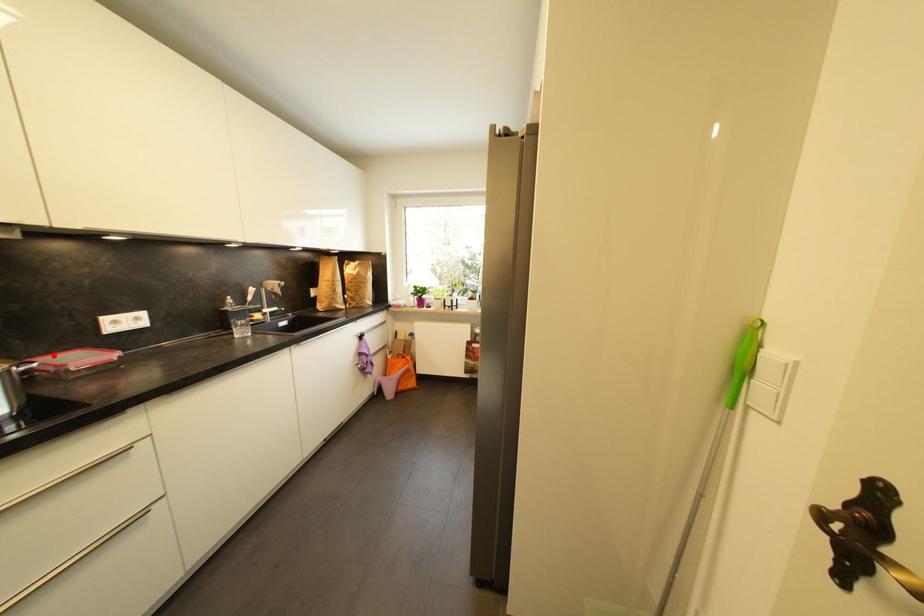
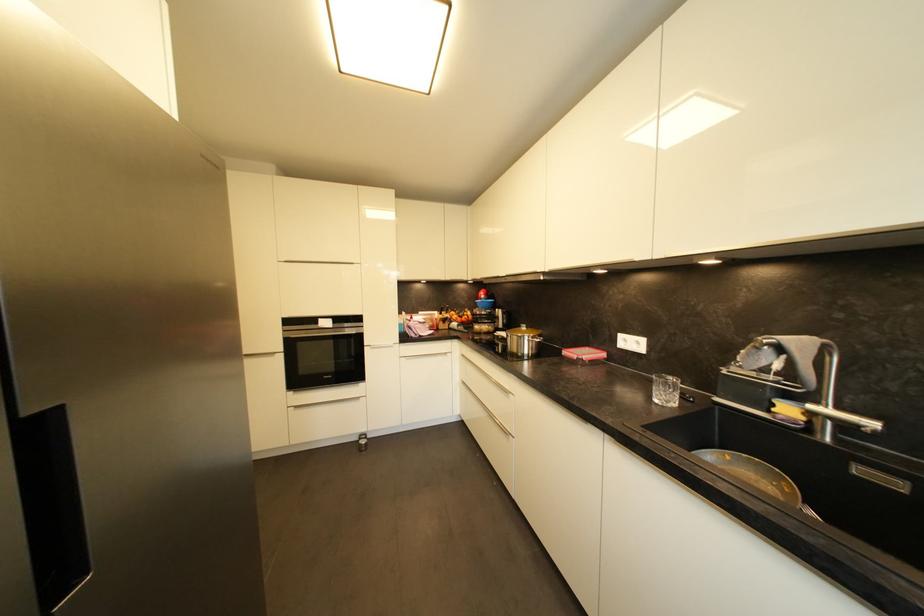
Find the pixel in the second image that matches the highlighted location in the first image.

(602, 350)